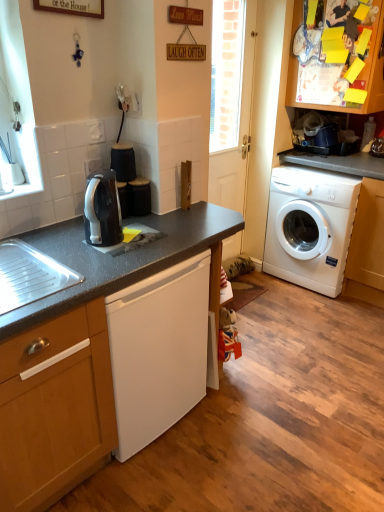
Locate an element on the screen. The width and height of the screenshot is (384, 512). empty space that is ontop of black granite countertop at center (from a real-world perspective) is located at coordinates (132, 232).